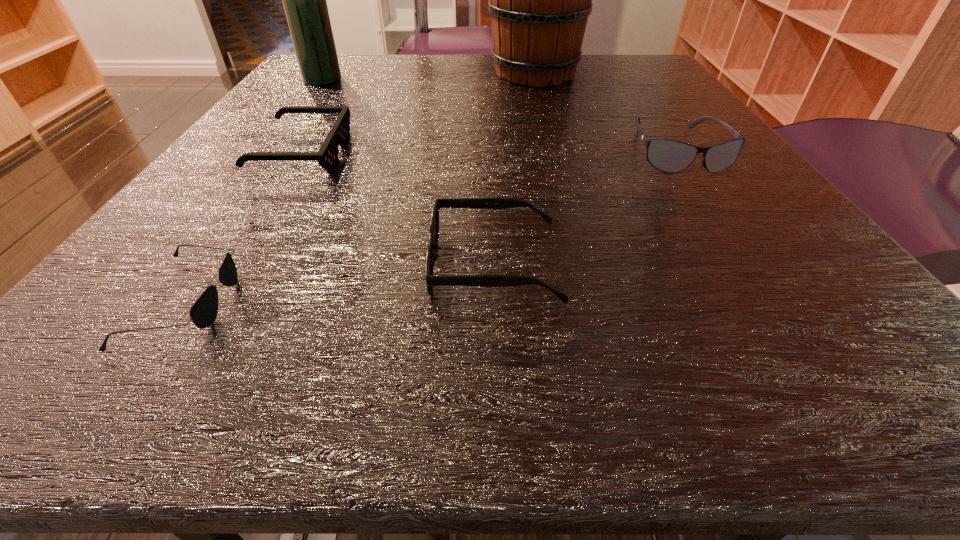
The height and width of the screenshot is (540, 960). What are the coordinates of `vacant space located at the front lenses of the third sunglasses from left to right` in the screenshot? It's located at (207, 265).

The width and height of the screenshot is (960, 540). Find the location of `free space located on the lenses of the shortest object`. free space located on the lenses of the shortest object is located at coordinates (492, 301).

Where is `wine bucket at the far edge`? This screenshot has height=540, width=960. wine bucket at the far edge is located at coordinates (539, 0).

Identify the location of alcohol that is positioned at the far edge. (304, 0).

Identify the location of object present at the near edge. (203, 313).

Locate an element on the screen. Image resolution: width=960 pixels, height=540 pixels. alcohol positioned at the left edge is located at coordinates (304, 0).

You are a GUI agent. You are given a task and a screenshot of the screen. Output one action in this format:
    pyautogui.click(x=<x>, y=<y>)
    Task: Click on the object that is at the right edge
    Image resolution: width=960 pixels, height=540 pixels.
    Given the screenshot: What is the action you would take?
    pyautogui.click(x=667, y=155)

Identify the location of object that is at the far left corner. Image resolution: width=960 pixels, height=540 pixels. (304, 0).

Find the location of a particular element. The height and width of the screenshot is (540, 960). object positioned at the near left corner is located at coordinates (203, 313).

Locate an element on the screen. The height and width of the screenshot is (540, 960). vacant area at the far edge is located at coordinates (476, 85).